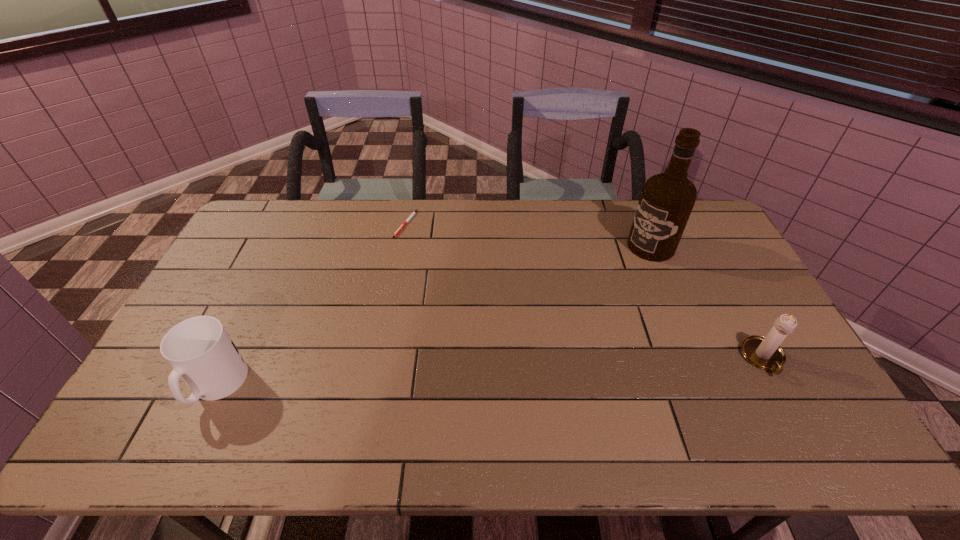
Where is `free space between the mug and the rightmost object`? free space between the mug and the rightmost object is located at coordinates (491, 372).

Where is `free space that is in between the leftmost object and the pen`? The image size is (960, 540). free space that is in between the leftmost object and the pen is located at coordinates (311, 305).

Find the location of a particular element. Image resolution: width=960 pixels, height=540 pixels. free space that is in between the shortest object and the leftmost object is located at coordinates click(311, 305).

Identify the location of object that is the closest to the mug. The width and height of the screenshot is (960, 540). (401, 227).

Identify which object is located as the nearest to the leftmost object. Please provide its 2D coordinates. Your answer should be formatted as a tuple, i.e. [(x, y)], where the tuple contains the x and y coordinates of a point satisfying the conditions above.

[(401, 227)]